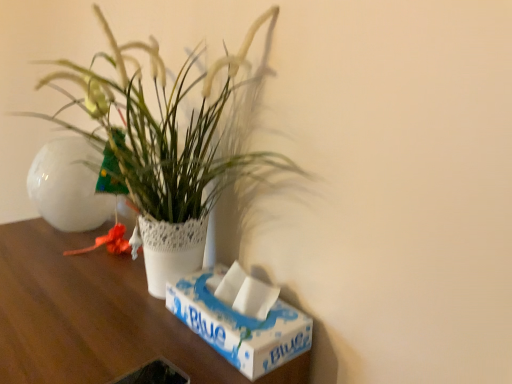
Question: In terms of size, does white lace pot at center appear bigger or smaller than wooden table at center?

Choices:
 (A) big
 (B) small

Answer: (B)

Question: Is point (253, 23) closer or farther from the camera than point (146, 360)?

Choices:
 (A) farther
 (B) closer

Answer: (A)

Question: Estimate the real-world distances between objects in this image. Which object is farther from the white glossy flowerpot at left?

Choices:
 (A) white lace pot at center
 (B) white cardboard box at lower right
 (C) wooden table at center

Answer: (B)

Question: Considering the real-world distances, which object is closest to the white glossy flowerpot at left?

Choices:
 (A) white lace pot at center
 (B) white cardboard box at lower right
 (C) wooden table at center

Answer: (C)